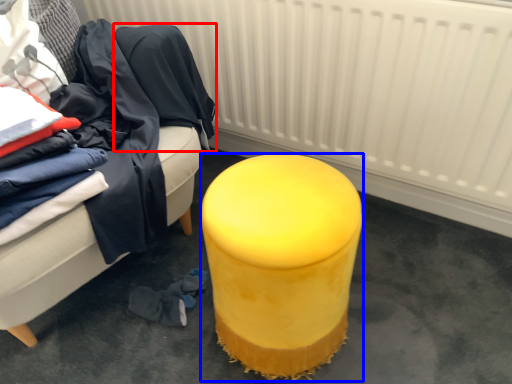
Question: Which object appears closest to the camera in this image, clothing (highlighted by a red box) or stool (highlighted by a blue box)?

Choices:
 (A) clothing
 (B) stool

Answer: (B)